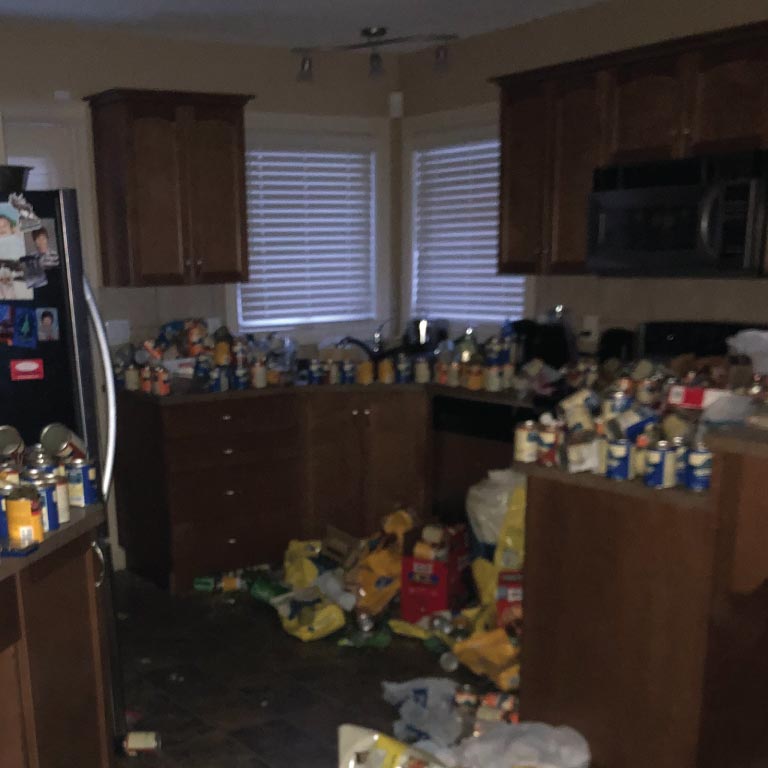
Find the location of a particular element. The height and width of the screenshot is (768, 768). hung cabinets is located at coordinates (167, 187), (511, 197), (676, 116).